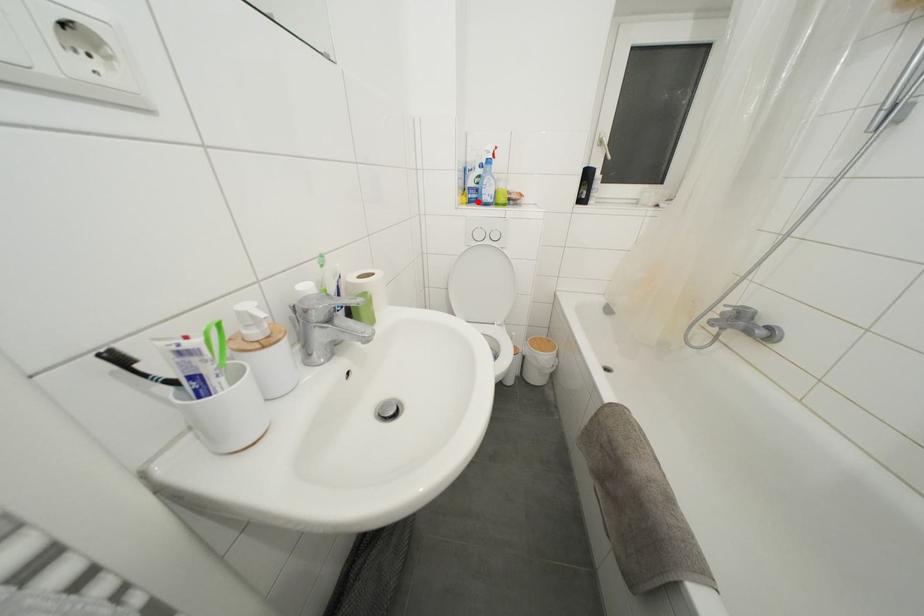
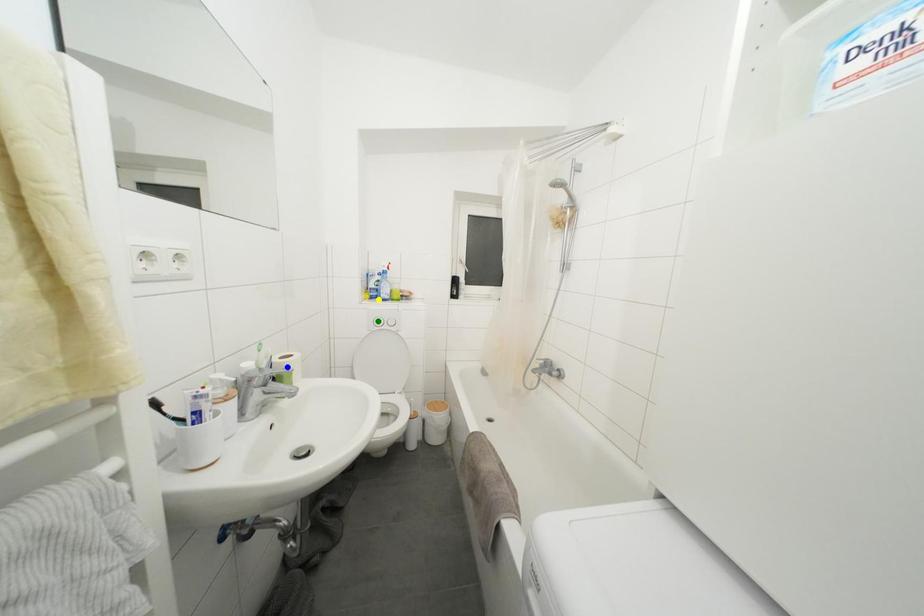
Question: I am providing you with two images of the same scene from different viewpoints. A red point is marked on the first image. You are given multiple points on the second image. Which point in image 2 is actually the same real-world point as the red point in image 1?

Choices:
 (A) yellow point
 (B) green point
 (C) blue point

Answer: (A)